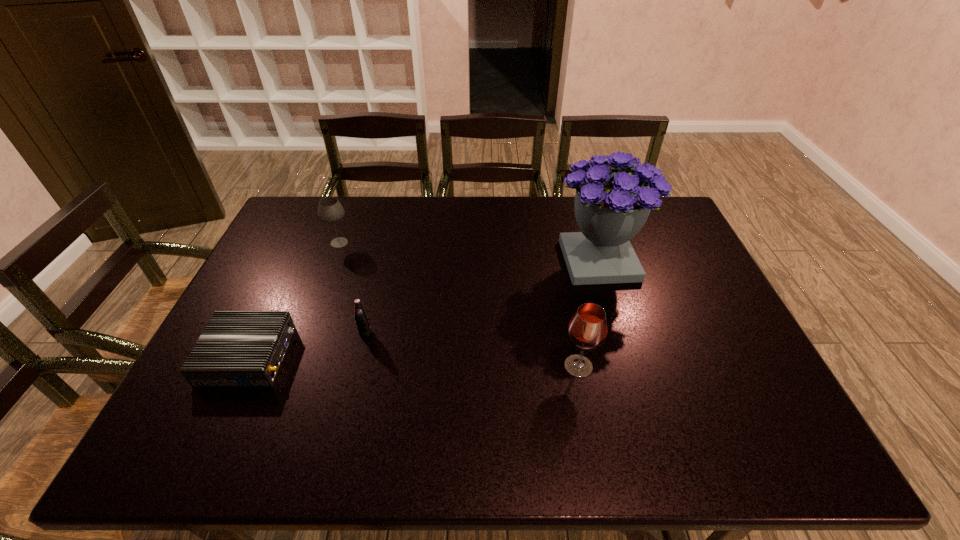
The image size is (960, 540). Identify the location of vacant area at the far left corner of the desktop. (319, 196).

In order to click on vacant space at the far right corner of the desktop in this screenshot , I will do `click(674, 222)`.

Find the location of a particular element. This screenshot has height=540, width=960. free space that is in between the nearer wineglass and the farther wineglass is located at coordinates (459, 305).

Image resolution: width=960 pixels, height=540 pixels. Find the location of `vacant space that's between the taller wineglass and the router`. vacant space that's between the taller wineglass and the router is located at coordinates pyautogui.click(x=414, y=361).

The image size is (960, 540). What are the coordinates of `free point between the bouquet and the shortest object` in the screenshot? It's located at (423, 308).

This screenshot has height=540, width=960. Identify the location of free space between the tallest object and the third object from right to left. (482, 297).

Find the location of a particular element. vacant space that is in between the left wineglass and the right wineglass is located at coordinates click(x=459, y=305).

Find the location of a particular element. vacant area that lies between the pop and the farther wineglass is located at coordinates coord(352,288).

Where is `free space that is in between the bouquet and the third object from right to left`? The width and height of the screenshot is (960, 540). free space that is in between the bouquet and the third object from right to left is located at coordinates (482, 297).

In order to click on empty space that is in between the shorter wineglass and the second shortest object in this screenshot , I will do `click(352, 288)`.